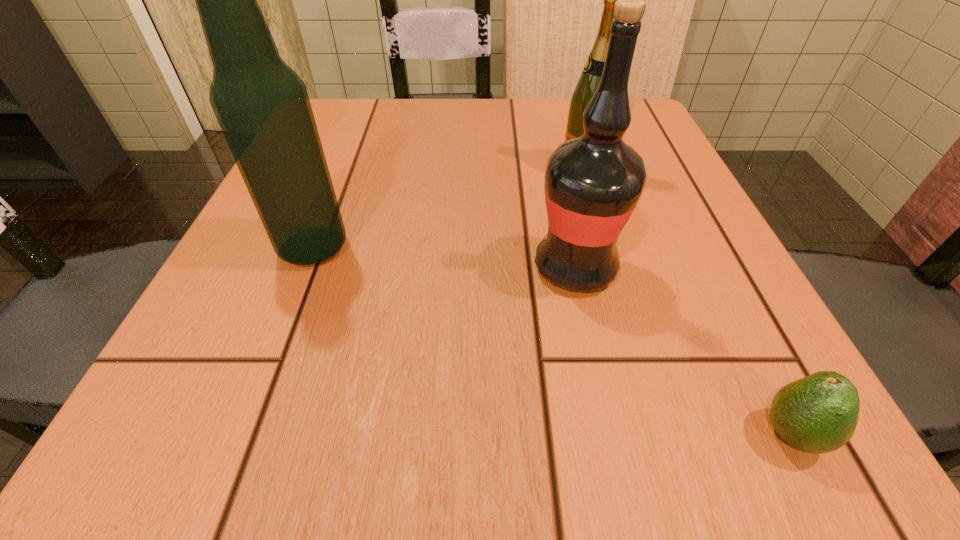
Find the location of `vacant space at the right edge`. vacant space at the right edge is located at coordinates (683, 176).

Image resolution: width=960 pixels, height=540 pixels. Find the location of `free region at the far left corner of the desktop`. free region at the far left corner of the desktop is located at coordinates 331,152.

The image size is (960, 540). In the image, there is a desktop. Identify the location of vacant space at the near right corner. (783, 445).

Where is `vacant area that lies between the farther wine bottle and the alcohol`? vacant area that lies between the farther wine bottle and the alcohol is located at coordinates (448, 208).

Find the location of `unoccupied area between the farther wine bottle and the alcohol`. unoccupied area between the farther wine bottle and the alcohol is located at coordinates (448, 208).

At what (x,y) coordinates should I click in order to perform the action: click on blank region between the alcohol and the rightmost object. Please return your answer as a coordinate pair (x, y). Looking at the image, I should click on (552, 341).

Locate an element on the screen. Image resolution: width=960 pixels, height=540 pixels. vacant area that lies between the nearer wine bottle and the tallest object is located at coordinates (444, 258).

At what (x,y) coordinates should I click in order to perform the action: click on vacant region between the rightmost object and the farther wine bottle. Please return your answer as a coordinate pair (x, y). This screenshot has height=540, width=960. Looking at the image, I should click on click(687, 301).

Where is `free space between the nearer wine bottle and the avocado`? Image resolution: width=960 pixels, height=540 pixels. free space between the nearer wine bottle and the avocado is located at coordinates (684, 351).

Identify the location of free spot between the tallest object and the nearer wine bottle. The image size is (960, 540). (444, 258).